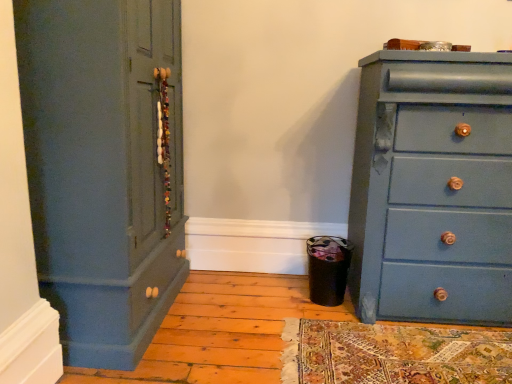
Question: Considering their positions, is matte blue cupboard at left located in front of or behind matte blue dresser at right?

Choices:
 (A) front
 (B) behind

Answer: (A)

Question: Considering the positions of matte blue cupboard at left and matte blue dresser at right in the image, is matte blue cupboard at left bigger or smaller than matte blue dresser at right?

Choices:
 (A) big
 (B) small

Answer: (A)

Question: Looking at their shapes, would you say matte blue cupboard at left is wider or thinner than matte blue dresser at right?

Choices:
 (A) thin
 (B) wide

Answer: (B)

Question: Relative to matte blue cupboard at left, is matte blue dresser at right in front or behind?

Choices:
 (A) behind
 (B) front

Answer: (A)

Question: From the image's perspective, is matte blue dresser at right located above or below matte blue cupboard at left?

Choices:
 (A) above
 (B) below

Answer: (B)

Question: Is matte blue dresser at right spatially inside matte blue cupboard at left, or outside of it?

Choices:
 (A) inside
 (B) outside

Answer: (B)

Question: Is matte blue dresser at right to the left or to the right of matte blue cupboard at left in the image?

Choices:
 (A) right
 (B) left

Answer: (A)